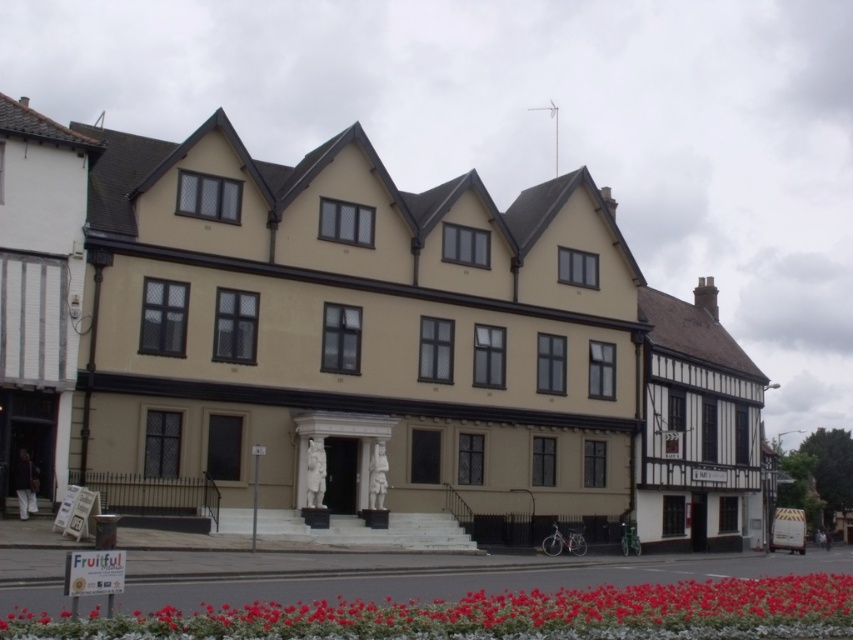
Can you confirm if vivid red petals at lower center is positioned to the right of wooden half-timbered house at right?

Incorrect, vivid red petals at lower center is not on the right side of wooden half-timbered house at right.

Which is below, vivid red petals at lower center or wooden half-timbered house at right?

vivid red petals at lower center is lower down.

Locate an element on the screen. The image size is (853, 640). vivid red petals at lower center is located at coordinates (496, 614).

Is vivid red petals at lower center thinner than white timber-framed building at left?

No.

This screenshot has height=640, width=853. Describe the element at coordinates (496, 614) in the screenshot. I see `vivid red petals at lower center` at that location.

I want to click on vivid red petals at lower center, so click(496, 614).

Is beige stone building at center smaller than white timber-framed building at left?

Actually, beige stone building at center might be larger than white timber-framed building at left.

Is point (393, 445) positioned behind point (84, 154)?

Yes, point (393, 445) is farther from viewer.

Image resolution: width=853 pixels, height=640 pixels. I want to click on beige stone building at center, so click(x=357, y=332).